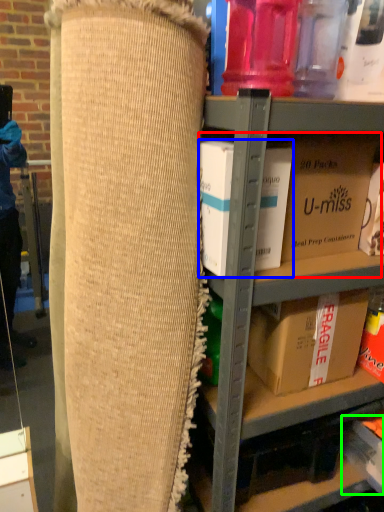
Question: Which is nearer to the storage box (highlighted by a red box)? box (highlighted by a blue box) or storage box (highlighted by a green box).

Choices:
 (A) box
 (B) storage box

Answer: (A)